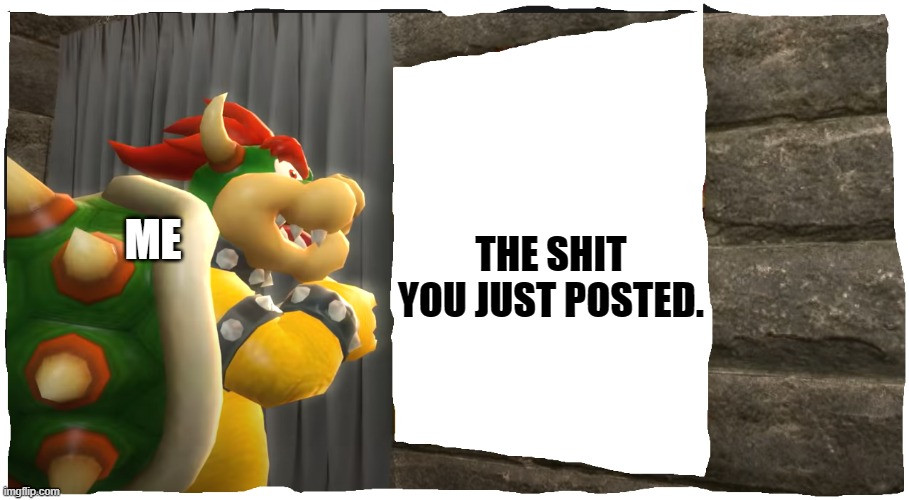
At what (x,y) coordinates should I click in order to perform the action: click on wall. Please return your answer as a coordinate pair (x, y). This screenshot has width=909, height=500. Looking at the image, I should click on (800, 192), (42, 89).